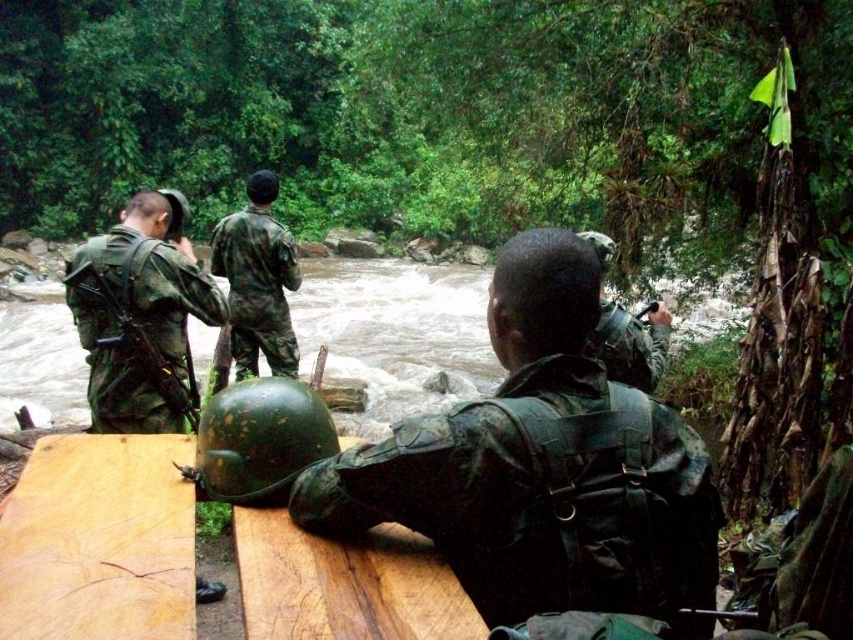
Question: Based on their relative distances, which object is nearer to the camouflage fabric helmet at left?

Choices:
 (A) camouflage fabric helmet at upper center
 (B) camouflage fabric uniform at center
 (C) green matte helmet at center

Answer: (B)

Question: Which object appears closest to the camera in this image?

Choices:
 (A) green matte helmet at center
 (B) brown wood plank at lower left
 (C) camouflage fabric helmet at center
 (D) camouflage fabric helmet at left

Answer: (B)

Question: Is green matte helmet at center to the right of camouflage fabric uniform at center from the viewer's perspective?

Choices:
 (A) no
 (B) yes

Answer: (B)

Question: Does camouflage fabric helmet at center appear on the left side of wooden table at center?

Choices:
 (A) no
 (B) yes

Answer: (A)

Question: Where is camouflage fabric helmet at center located in relation to camouflage fabric uniform at center in the image?

Choices:
 (A) above
 (B) below

Answer: (B)

Question: Which point is farther to the camera?

Choices:
 (A) brown wood plank at lower left
 (B) wooden table at center
 (C) camouflage fabric uniform at center

Answer: (C)